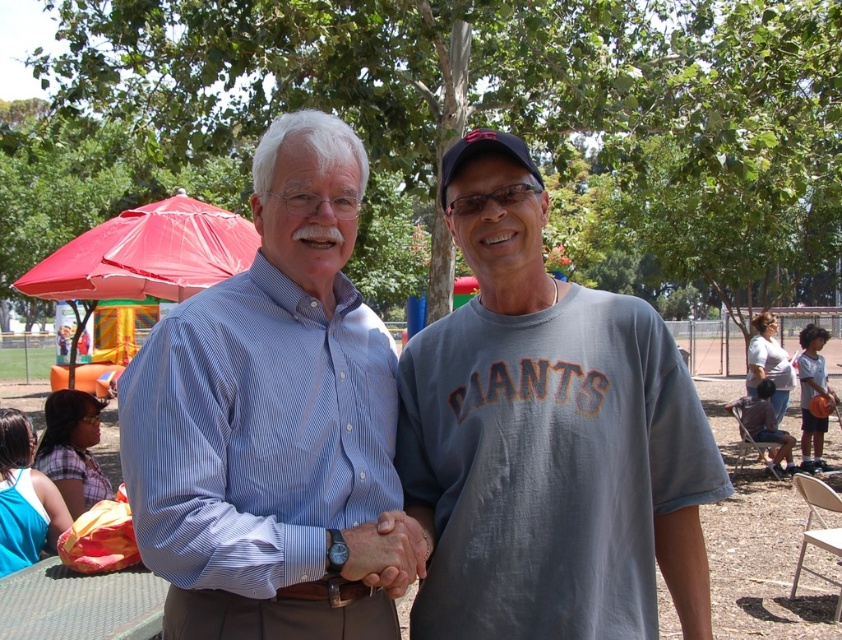
Question: Does blue striped shirt at center come in front of gray cotton t-shirt at lower right?

Choices:
 (A) yes
 (B) no

Answer: (A)

Question: Which point is closer to the camera?

Choices:
 (A) gray cotton t-shirt at center
 (B) blue striped shirt at center

Answer: (B)

Question: Estimate the real-world distances between objects in this image. Which object is farther from the gray cotton t-shirt at center?

Choices:
 (A) blue striped shirt at center
 (B) red plastic umbrella at upper left
 (C) green plastic picnic table at lower left

Answer: (B)

Question: Which of these objects is positioned closest to the gray cotton t-shirt at lower right?

Choices:
 (A) blue striped shirt at center
 (B) red plastic umbrella at upper left

Answer: (B)

Question: In this image, where is red plastic umbrella at upper left located relative to gray cotton t-shirt at lower right?

Choices:
 (A) above
 (B) below

Answer: (A)

Question: Can you confirm if red plastic umbrella at upper left is thinner than green plastic picnic table at lower left?

Choices:
 (A) yes
 (B) no

Answer: (B)